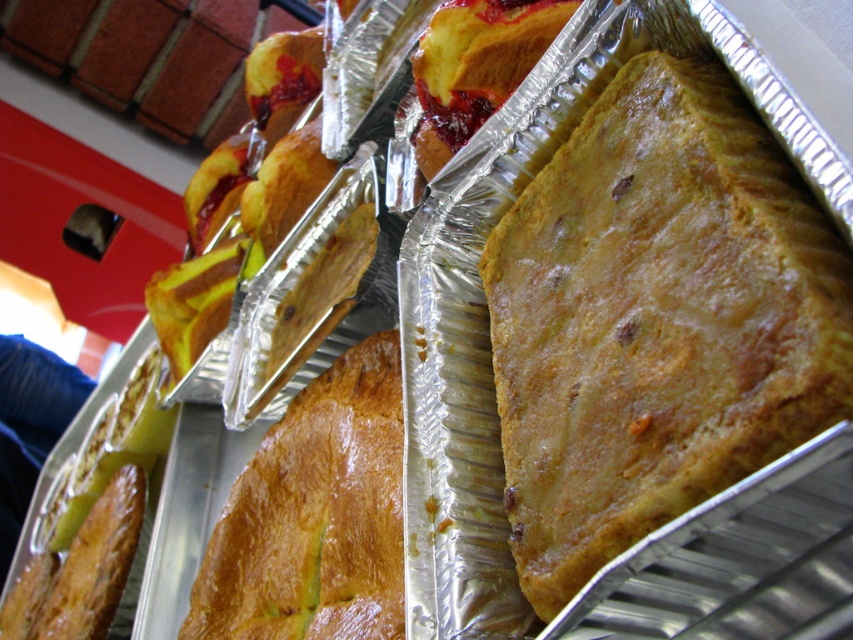
Is point (612, 172) closer to camera compared to point (181, 637)?

Yes.

Can you confirm if golden brown flaky pastry at center is positioned below golden brown crusty bread at center?

Actually, golden brown flaky pastry at center is above golden brown crusty bread at center.

Between point (792, 376) and point (212, 600), which one is positioned behind?

Point (212, 600)

At what (x,y) coordinates should I click in order to perform the action: click on golden brown flaky pastry at center. Please return your answer as a coordinate pair (x, y). Looking at the image, I should click on (656, 320).